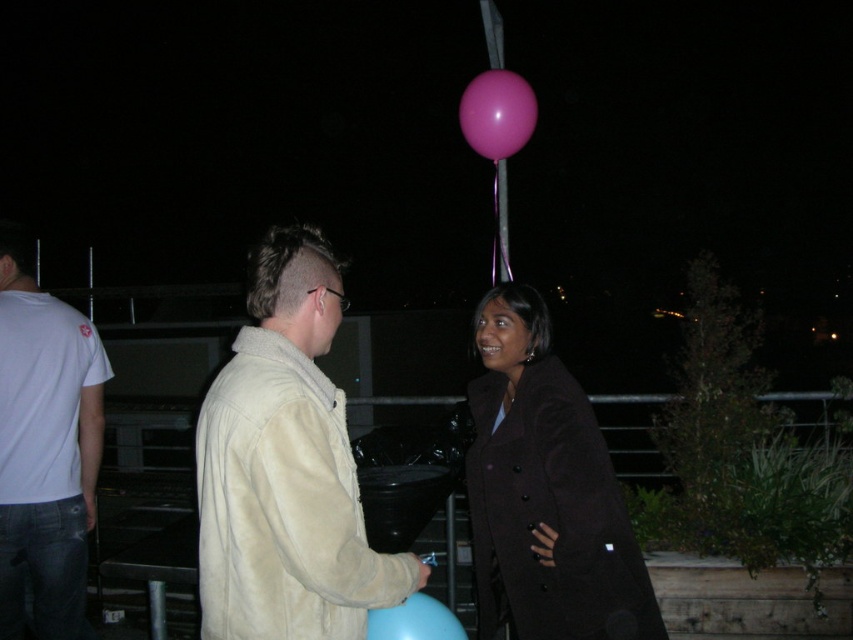
Is dark brown wool coat at center to the right of pink rubber balloon at upper center from the viewer's perspective?

Yes, dark brown wool coat at center is to the right of pink rubber balloon at upper center.

Between point (575, 616) and point (494, 115), which one is positioned behind?

The point (494, 115) is behind.

Is point (474, 449) less distant than point (500, 145)?

That is True.

Locate an element on the screen. This screenshot has width=853, height=640. dark brown wool coat at center is located at coordinates click(x=544, y=492).

Image resolution: width=853 pixels, height=640 pixels. Describe the element at coordinates (286, 467) in the screenshot. I see `suede jacket at center` at that location.

Does point (328, 593) come in front of point (477, 124)?

That is True.

Describe the element at coordinates (286, 467) in the screenshot. I see `suede jacket at center` at that location.

Identify the location of suede jacket at center. (286, 467).

Is the position of suede jacket at center less distant than that of blue rubber balloon at lower center?

Yes, it is in front of blue rubber balloon at lower center.

Is suede jacket at center shorter than blue rubber balloon at lower center?

No, suede jacket at center is not shorter than blue rubber balloon at lower center.

The image size is (853, 640). I want to click on suede jacket at center, so click(286, 467).